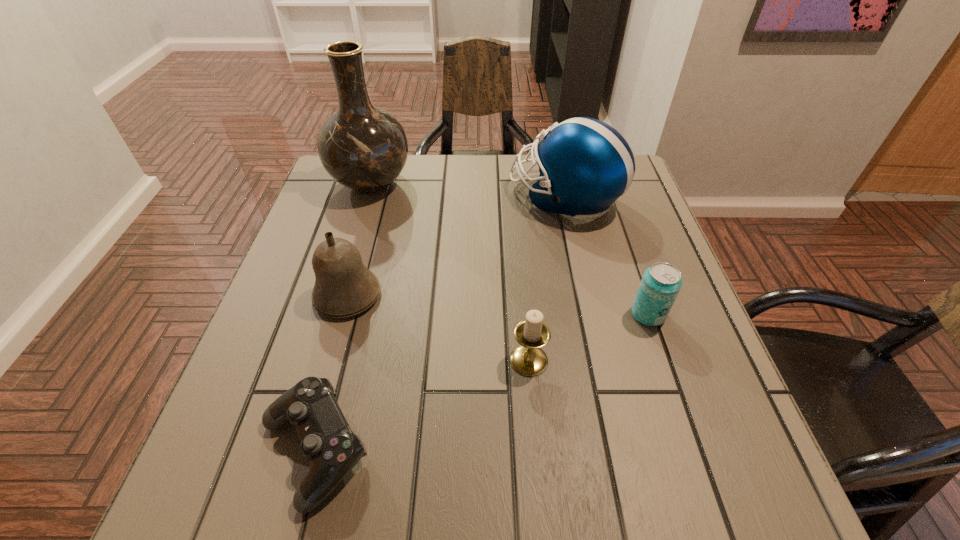
Identify which object is the fifth nearest to the fifth farthest object. Please provide its 2D coordinates. Your answer should be formatted as a tuple, i.e. [(x, y)], where the tuple contains the x and y coordinates of a point satisfying the conditions above.

[(363, 147)]

At what (x,y) coordinates should I click in order to perform the action: click on free space in the image that satisfies the following two spatial constraints: 1. on the back side of the candle holder; 2. on the left side of the shortest object. Please return your answer as a coordinate pair (x, y). Looking at the image, I should click on (339, 360).

The height and width of the screenshot is (540, 960). Identify the location of vacant area in the image that satisfies the following two spatial constraints: 1. on the back side of the candle holder; 2. on the left side of the control. [339, 360].

Locate an element on the screen. vacant area that satisfies the following two spatial constraints: 1. at the front of the fifth shortest object with the faceguard; 2. on the front side of the candle holder is located at coordinates (601, 360).